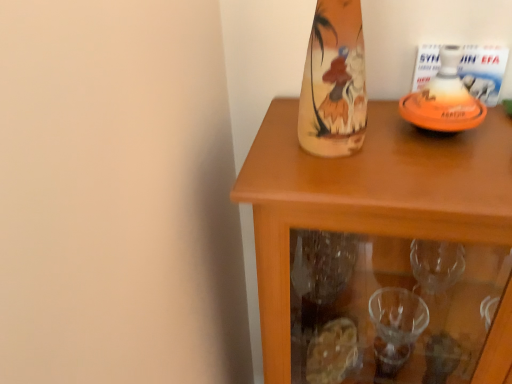
Question: Does point (338, 168) appear closer or farther from the camera than point (407, 96)?

Choices:
 (A) closer
 (B) farther

Answer: (A)

Question: Considering the positions of wooden cabinet at upper right and orange matte bottle at upper right in the image, is wooden cabinet at upper right bigger or smaller than orange matte bottle at upper right?

Choices:
 (A) small
 (B) big

Answer: (B)

Question: Considering the positions of wooden cabinet at upper right and orange matte bottle at upper right in the image, is wooden cabinet at upper right wider or thinner than orange matte bottle at upper right?

Choices:
 (A) thin
 (B) wide

Answer: (B)

Question: Is orange matte bottle at upper right situated inside wooden cabinet at upper right or outside?

Choices:
 (A) outside
 (B) inside

Answer: (A)

Question: From a real-world perspective, relative to wooden cabinet at upper right, is orange matte bottle at upper right vertically above or below?

Choices:
 (A) below
 (B) above

Answer: (B)

Question: From the image's perspective, is orange matte bottle at upper right above or below wooden cabinet at upper right?

Choices:
 (A) below
 (B) above

Answer: (B)

Question: In terms of height, does orange matte bottle at upper right look taller or shorter compared to wooden cabinet at upper right?

Choices:
 (A) tall
 (B) short

Answer: (B)